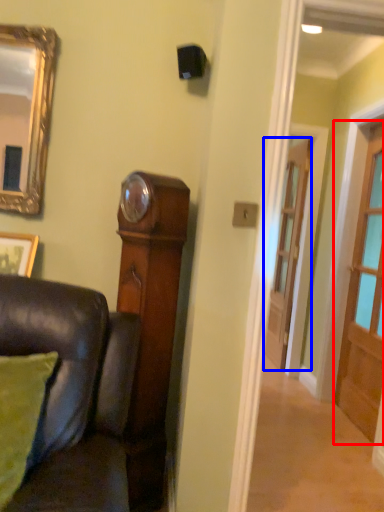
Question: Which of the following is the farthest to the observer, door (highlighted by a red box) or door (highlighted by a blue box)?

Choices:
 (A) door
 (B) door

Answer: (B)